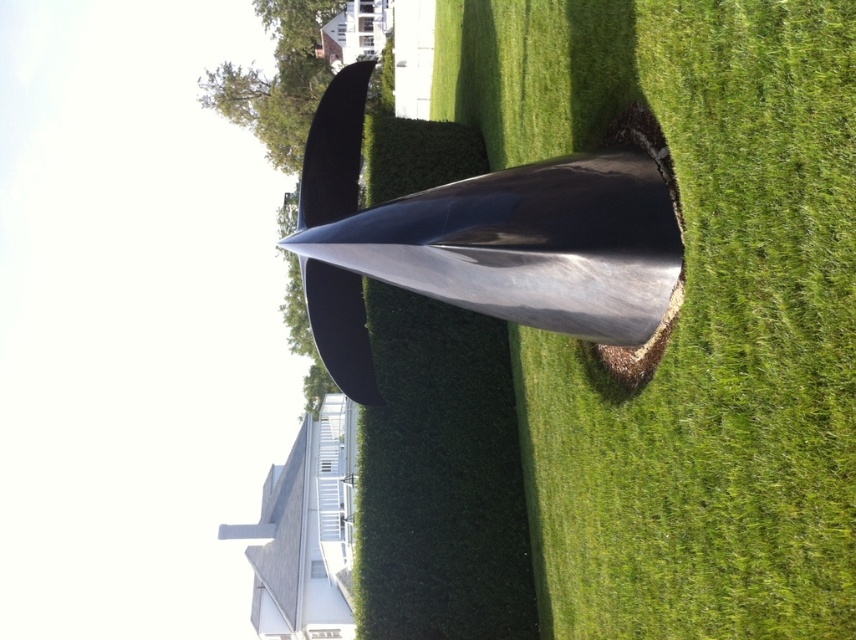
The width and height of the screenshot is (856, 640). In order to click on green grass at center in this screenshot , I will do `click(690, 314)`.

Who is shorter, green grass at center or shiny metallic cone at center?

Standing shorter between the two is shiny metallic cone at center.

Does point (852, 132) come behind point (655, 236)?

No, it is not.

The width and height of the screenshot is (856, 640). In order to click on green grass at center in this screenshot , I will do `click(690, 314)`.